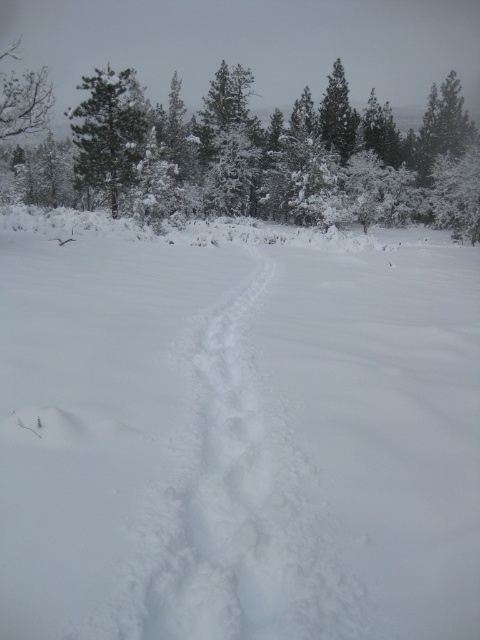
Is white fluffy snow trail at center below green matte tree at upper left?

Yes.

Between white fluffy snow trail at center and green matte tree at upper left, which one has less height?

Standing shorter between the two is white fluffy snow trail at center.

Is point (226, 516) positioned before point (85, 113)?

Yes, it is in front of point (85, 113).

At what (x,y) coordinates should I click in order to perform the action: click on white fluffy snow trail at center. Please return your answer as a coordinate pair (x, y). The height and width of the screenshot is (640, 480). Looking at the image, I should click on 248,512.

Can you confirm if white fluffy snow at center is smaller than snow-covered evergreen tree at upper center?

Indeed, white fluffy snow at center has a smaller size compared to snow-covered evergreen tree at upper center.

Between white fluffy snow at center and snow-covered evergreen tree at upper center, which one has less height?

Standing shorter between the two is white fluffy snow at center.

This screenshot has width=480, height=640. What are the coordinates of `white fluffy snow at center` in the screenshot? It's located at (237, 433).

Where is `white fluffy snow at center`? This screenshot has width=480, height=640. white fluffy snow at center is located at coordinates (237, 433).

Is snow-covered evergreen tree at upper center below white fluffy snow trail at center?

Actually, snow-covered evergreen tree at upper center is above white fluffy snow trail at center.

In the scene shown: Is snow-covered evergreen tree at upper center to the right of white fluffy snow trail at center from the viewer's perspective?

Correct, you'll find snow-covered evergreen tree at upper center to the right of white fluffy snow trail at center.

This screenshot has height=640, width=480. In order to click on snow-covered evergreen tree at upper center in this screenshot , I will do `click(257, 156)`.